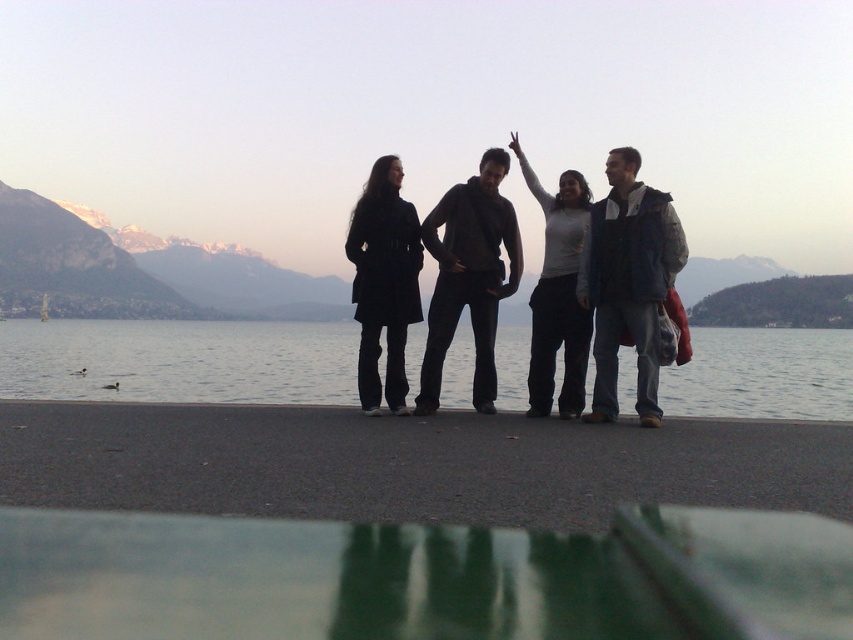
You are a photographer trying to capture a wide shot of the group without any obstructions. The transparent water at lower center and the black matte coat at left are in the foreground. Which object could potentially block the view of the group if positioned closer to the camera?

The black matte coat at left is closer to the camera than the transparent water at lower center, so it might block the view of the group.

You are standing on the waterfront promenade and want to take a photo of the transparent water at lower center and the dark gray hoodie at center. Which object should you point your camera towards first if you want to capture both in a single shot without moving the camera?

You should point your camera towards the dark gray hoodie at center first because the transparent water at lower center is to the right of it, so capturing the hoodie first will allow the water to be included in the frame to its right.

You are a photographer trying to capture a group photo of the transparent water at lower center and the dark gray hoodie at center. Since you want to ensure both subjects are in focus, you need to know which one is wider. Which object is wider?

The transparent water at lower center is wider than the dark gray hoodie at center.